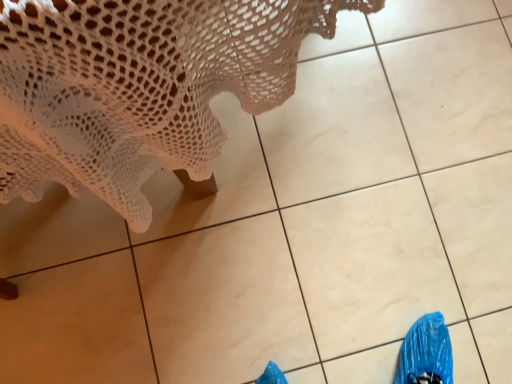
This screenshot has width=512, height=384. What do you see at coordinates (138, 86) in the screenshot? I see `white lace tablecloth at upper left` at bounding box center [138, 86].

Measure the distance between white lace tablecloth at upper left and camera.

9.02 inches.

Where is `white lace tablecloth at upper left`? This screenshot has width=512, height=384. white lace tablecloth at upper left is located at coordinates (138, 86).

Identify the location of white lace tablecloth at upper left. The height and width of the screenshot is (384, 512). (138, 86).